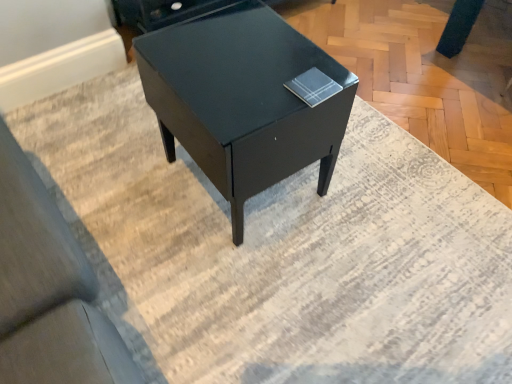
Question: Should I look upward or downward to see matte black table at center?

Choices:
 (A) down
 (B) up

Answer: (B)